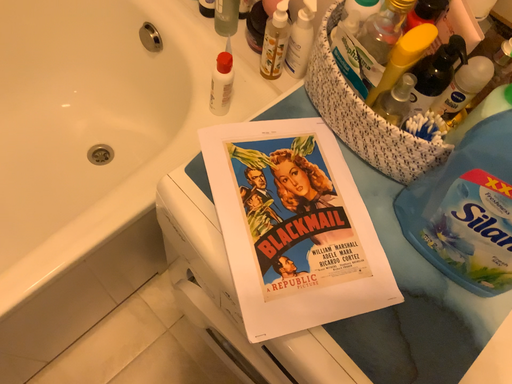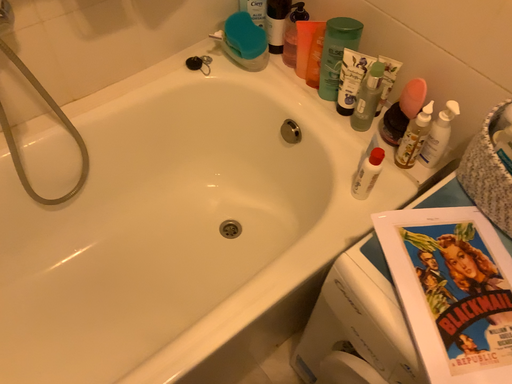
Question: Which way did the camera rotate in the video?

Choices:
 (A) rotated downward
 (B) rotated upward

Answer: (B)